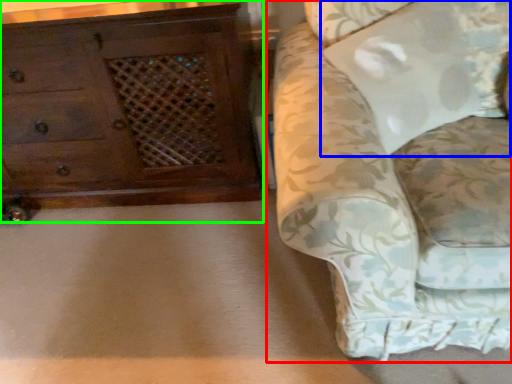
Question: Based on their relative distances, which object is farther from studio couch (highlighted by a red box)? Choose from pillow (highlighted by a blue box) and chest of drawers (highlighted by a green box).

Choices:
 (A) pillow
 (B) chest of drawers

Answer: (B)